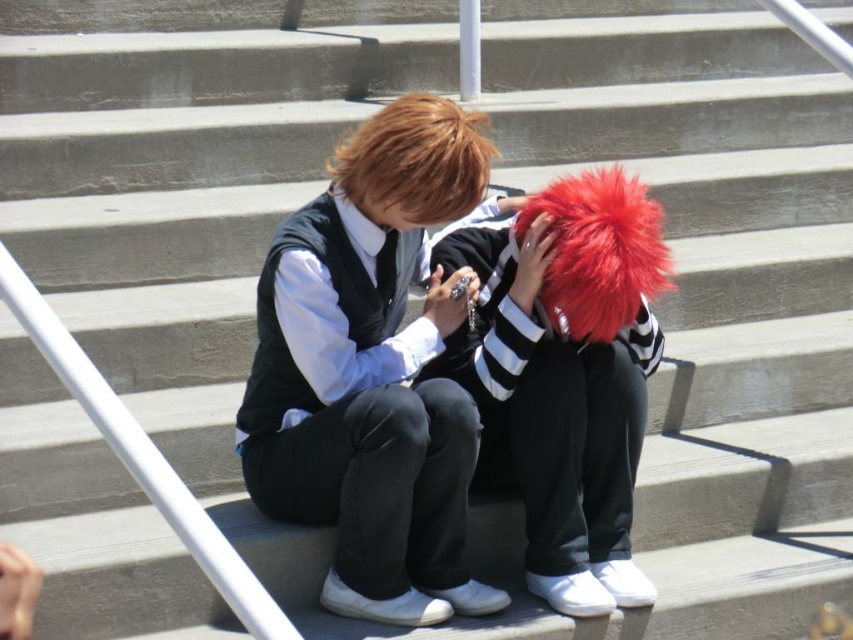
Looking at this image, you are a photographer trying to capture a closeup of both the fluffy red wig at center and the shiny brown hair at upper center in the image. Based on their sizes, which object should you focus on first to ensure it fits within your camera frame?

The fluffy red wig at center might be wider than shiny brown hair at upper center, so you should focus on the fluffy red wig at center first to ensure it fits within your camera frame.

You are designing a new fashion line and want to incorporate both the matte black vest at center and the fluffy red wig at center into an outfit. Based on their sizes, which item would require more space in the display window?

The matte black vest at center might be wider than fluffy red wig at center, so it would require more space in the display window.

You are an artist trying to sketch the scene. The fluffy red wig at center is crucial for your drawing. Where exactly should you place it in your 2D canvas coordinates?

The fluffy red wig at center should be placed at the 2D coordinates point [566,374].